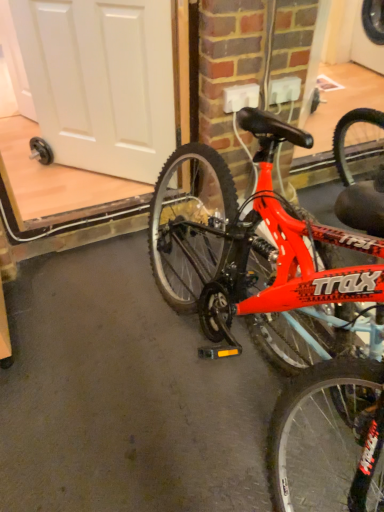
Question: Is white matte door at upper left wider or thinner than shiny red bicycle at center?

Choices:
 (A) wide
 (B) thin

Answer: (B)

Question: Relative to shiny red bicycle at center, is white matte door at upper left in front or behind?

Choices:
 (A) front
 (B) behind

Answer: (B)

Question: Which is correct: white matte door at upper left is inside shiny red bicycle at center, or outside of it?

Choices:
 (A) outside
 (B) inside

Answer: (A)

Question: In the image, is shiny red bicycle at center positioned in front of or behind white matte door at upper left?

Choices:
 (A) front
 (B) behind

Answer: (A)

Question: In terms of height, does shiny red bicycle at center look taller or shorter compared to white matte door at upper left?

Choices:
 (A) short
 (B) tall

Answer: (B)

Question: Considering the positions of shiny red bicycle at center and white matte door at upper left in the image, is shiny red bicycle at center bigger or smaller than white matte door at upper left?

Choices:
 (A) small
 (B) big

Answer: (B)

Question: Is shiny red bicycle at center inside or outside of white matte door at upper left?

Choices:
 (A) outside
 (B) inside

Answer: (A)